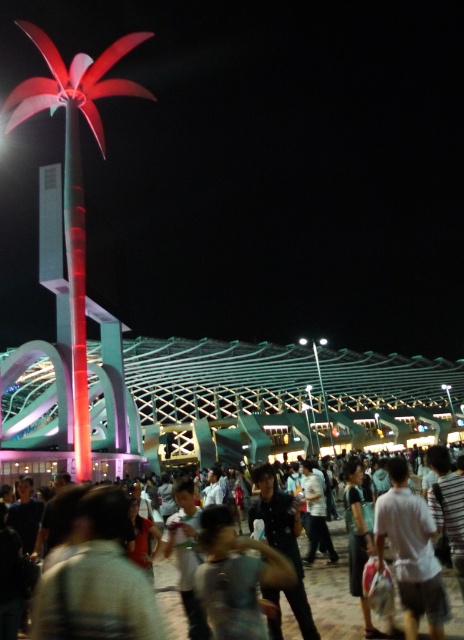
Does shiny metallic palm tree at left appear on the left side of matte black crowd at center?

Correct, you'll find shiny metallic palm tree at left to the left of matte black crowd at center.

Between shiny metallic palm tree at left and matte black crowd at center, which one appears on the right side from the viewer's perspective?

matte black crowd at center

Measure the distance between shiny metallic palm tree at left and camera.

They are 66.46 meters apart.

This screenshot has height=640, width=464. In order to click on shiny metallic palm tree at left in this screenshot , I will do `click(73, 180)`.

Which of these two, shiny metallic palm tree at left or white matte shirt at lower right, stands taller?

shiny metallic palm tree at left

Between point (70, 232) and point (408, 584), which one is positioned in front?

Point (408, 584)

From the picture: Who is more distant from viewer, (81,220) or (404,568)?

The point (81,220) is more distant.

At what (x,y) coordinates should I click in order to perform the action: click on shiny metallic palm tree at left. Please return your answer as a coordinate pair (x, y). Looking at the image, I should click on (73, 180).

Who is taller, white matte shirt at lower right or matte black crowd at center?

Standing taller between the two is white matte shirt at lower right.

Is point (433, 580) less distant than point (355, 630)?

Yes, it is in front of point (355, 630).

At what (x,y) coordinates should I click in order to perform the action: click on white matte shirt at lower right. Please return your answer as a coordinate pair (x, y). This screenshot has height=640, width=464. Looking at the image, I should click on (411, 552).